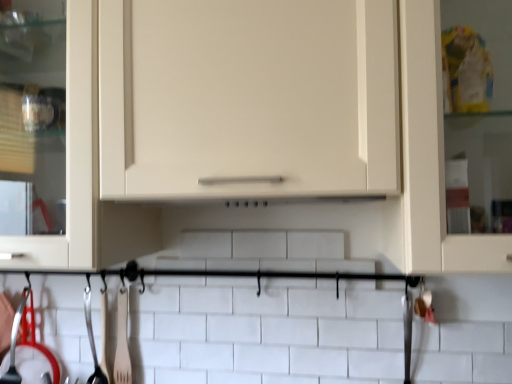
The width and height of the screenshot is (512, 384). What do you see at coordinates (28, 351) in the screenshot? I see `shiny metallic spoon at lower left, which is counted as the 3th silverware, starting from the right` at bounding box center [28, 351].

The width and height of the screenshot is (512, 384). What are the coordinates of `polished metal spatula at lower left, which is counted as the 2th silverware, starting from the right` in the screenshot? It's located at (92, 341).

Considering the positions of objects polished metal spatula at lower left, which is counted as the 2th silverware, starting from the right, and wooden fork at lower left, which appears as the first silverware when viewed from the right, in the image provided, who is in front, polished metal spatula at lower left, which is counted as the 2th silverware, starting from the right, or wooden fork at lower left, which appears as the first silverware when viewed from the right,?

wooden fork at lower left, which appears as the first silverware when viewed from the right, is in front.

What's the angular difference between polished metal spatula at lower left, which is counted as the 2th silverware, starting from the right, and wooden fork at lower left, the 4th silverware when ordered from left to right,'s facing directions?

The facing directions of polished metal spatula at lower left, which is counted as the 2th silverware, starting from the right, and wooden fork at lower left, the 4th silverware when ordered from left to right, are 0.000461 degrees apart.

Could you tell me if polished metal spatula at lower left, which is counted as the 2th silverware, starting from the right, is facing wooden fork at lower left, the 4th silverware when ordered from left to right?

No.

Considering the sizes of objects polished metal spatula at lower left, which is counted as the 2th silverware, starting from the right, and wooden fork at lower left, the 4th silverware when ordered from left to right, in the image provided, who is smaller, polished metal spatula at lower left, which is counted as the 2th silverware, starting from the right, or wooden fork at lower left, the 4th silverware when ordered from left to right,?

With smaller size is wooden fork at lower left, the 4th silverware when ordered from left to right.

Can you tell me how much matte white cabinet at center and polished metal ladle at lower left, the 1th silverware from the left, differ in facing direction?

There is a 22.2-degree angle between the facing directions of matte white cabinet at center and polished metal ladle at lower left, the 1th silverware from the left.

Is matte white cabinet at center positioned with its back to polished metal ladle at lower left, the 1th silverware from the left?

No, matte white cabinet at center is not facing the opposite direction of polished metal ladle at lower left, the 1th silverware from the left.

Where is `the 1st silverware below the matte white cabinet at center (from a real-world perspective)`? This screenshot has height=384, width=512. the 1st silverware below the matte white cabinet at center (from a real-world perspective) is located at coordinates (15, 343).

Can you confirm if polished metal ladle at lower left, positioned as the fourth silverware in right-to-left order, is shorter than wooden fork at lower left, which appears as the first silverware when viewed from the right?

No.

From the image's perspective, is polished metal ladle at lower left, the 1th silverware from the left, on wooden fork at lower left, which appears as the first silverware when viewed from the right?

Actually, polished metal ladle at lower left, the 1th silverware from the left, appears below wooden fork at lower left, which appears as the first silverware when viewed from the right, in the image.

Where is `the 1st silverware directly beneath the polished metal ladle at lower left, the 1th silverware from the left (from a real-world perspective)`? The height and width of the screenshot is (384, 512). the 1st silverware directly beneath the polished metal ladle at lower left, the 1th silverware from the left (from a real-world perspective) is located at coordinates (122, 340).

How different are the orientations of polished metal ladle at lower left, the 1th silverware from the left, and wooden fork at lower left, the 4th silverware when ordered from left to right, in degrees?

They differ by 21.4 degrees in their facing directions.

Would you say polished metal ladle at lower left, positioned as the fourth silverware in right-to-left order, contains shiny metallic spoon at lower left, which is counted as the 2th silverware, starting from the left?

No, shiny metallic spoon at lower left, which is counted as the 2th silverware, starting from the left, is located outside of polished metal ladle at lower left, positioned as the fourth silverware in right-to-left order.

Is polished metal ladle at lower left, positioned as the fourth silverware in right-to-left order, with shiny metallic spoon at lower left, which is counted as the 2th silverware, starting from the left?

Yes, polished metal ladle at lower left, positioned as the fourth silverware in right-to-left order, is in contact with shiny metallic spoon at lower left, which is counted as the 2th silverware, starting from the left.

Where is `the 3rd silverware in front of the polished metal ladle at lower left, positioned as the fourth silverware in right-to-left order, starting your count from the anchor`? Image resolution: width=512 pixels, height=384 pixels. the 3rd silverware in front of the polished metal ladle at lower left, positioned as the fourth silverware in right-to-left order, starting your count from the anchor is located at coordinates (28, 351).

Is matte white cabinet at center inside polished metal ladle at lower left, positioned as the fourth silverware in right-to-left order?

No, matte white cabinet at center is not inside polished metal ladle at lower left, positioned as the fourth silverware in right-to-left order.

From a real-world perspective, is polished metal ladle at lower left, positioned as the fourth silverware in right-to-left order, positioned under matte white cabinet at center based on gravity?

Yes, from a real-world perspective, polished metal ladle at lower left, positioned as the fourth silverware in right-to-left order, is under matte white cabinet at center.

Locate an element on the screen. The width and height of the screenshot is (512, 384). the 4th silverware behind the matte white cabinet at center is located at coordinates (15, 343).

Which object is positioned more to the left, polished metal ladle at lower left, positioned as the fourth silverware in right-to-left order, or matte white cabinet at center?

From the viewer's perspective, polished metal ladle at lower left, positioned as the fourth silverware in right-to-left order, appears more on the left side.

Are matte white cabinet at center and shiny metallic spoon at lower left, which is counted as the 3th silverware, starting from the right, far apart?

No, matte white cabinet at center is not far from shiny metallic spoon at lower left, which is counted as the 3th silverware, starting from the right.

From a real-world perspective, who is located lower, matte white cabinet at center or shiny metallic spoon at lower left, which is counted as the 3th silverware, starting from the right?

In real-world perspective, shiny metallic spoon at lower left, which is counted as the 3th silverware, starting from the right, is lower.

Relative to shiny metallic spoon at lower left, which is counted as the 2th silverware, starting from the left, is matte white cabinet at center in front or behind?

In the image, matte white cabinet at center appears in front of shiny metallic spoon at lower left, which is counted as the 2th silverware, starting from the left.

Can you confirm if matte white cabinet at center is taller than shiny metallic spoon at lower left, which is counted as the 2th silverware, starting from the left?

Indeed, matte white cabinet at center has a greater height compared to shiny metallic spoon at lower left, which is counted as the 2th silverware, starting from the left.

Which of these two, shiny metallic spoon at lower left, which is counted as the 3th silverware, starting from the right, or polished metal ladle at lower left, positioned as the fourth silverware in right-to-left order, stands taller?

polished metal ladle at lower left, positioned as the fourth silverware in right-to-left order.

Considering the relative positions of shiny metallic spoon at lower left, which is counted as the 3th silverware, starting from the right, and polished metal ladle at lower left, positioned as the fourth silverware in right-to-left order, in the image provided, is shiny metallic spoon at lower left, which is counted as the 3th silverware, starting from the right, to the left of polished metal ladle at lower left, positioned as the fourth silverware in right-to-left order, from the viewer's perspective?

No, shiny metallic spoon at lower left, which is counted as the 3th silverware, starting from the right, is not to the left of polished metal ladle at lower left, positioned as the fourth silverware in right-to-left order.

Which object is thinner, shiny metallic spoon at lower left, which is counted as the 3th silverware, starting from the right, or polished metal ladle at lower left, positioned as the fourth silverware in right-to-left order?

With smaller width is polished metal ladle at lower left, positioned as the fourth silverware in right-to-left order.

Is shiny metallic spoon at lower left, which is counted as the 2th silverware, starting from the left, further to the viewer compared to polished metal ladle at lower left, the 1th silverware from the left?

→ No.

From a real-world perspective, which silverware is the 2nd one underneath the wooden fork at lower left, the 4th silverware when ordered from left to right? Please provide its 2D coordinates.

[(92, 341)]

The width and height of the screenshot is (512, 384). In order to click on cabinetry lying above the polished metal ladle at lower left, positioned as the fourth silverware in right-to-left order (from the image's perspective) in this screenshot , I will do `click(255, 127)`.

Looking at the image, which one is located further to polished metal ladle at lower left, positioned as the fourth silverware in right-to-left order, polished metal spatula at lower left, which is counted as the 2th silverware, starting from the right, or matte white cabinet at center?

Among the two, matte white cabinet at center is located further to polished metal ladle at lower left, positioned as the fourth silverware in right-to-left order.

Looking at the image, which one is located further to matte white cabinet at center, wooden fork at lower left, which appears as the first silverware when viewed from the right, or shiny metallic spoon at lower left, which is counted as the 3th silverware, starting from the right?

shiny metallic spoon at lower left, which is counted as the 3th silverware, starting from the right.

Considering their positions, is matte white cabinet at center positioned further to polished metal spatula at lower left, which is counted as the 2th silverware, starting from the right, than polished metal ladle at lower left, positioned as the fourth silverware in right-to-left order?

Among the two, matte white cabinet at center is located further to polished metal spatula at lower left, which is counted as the 2th silverware, starting from the right.

Considering their positions, is shiny metallic spoon at lower left, which is counted as the 3th silverware, starting from the right, positioned closer to polished metal ladle at lower left, positioned as the fourth silverware in right-to-left order, than polished metal spatula at lower left, positioned as the 3th silverware in left-to-right order?

Based on the image, shiny metallic spoon at lower left, which is counted as the 3th silverware, starting from the right, appears to be nearer to polished metal ladle at lower left, positioned as the fourth silverware in right-to-left order.

Looking at the image, which one is located closer to shiny metallic spoon at lower left, which is counted as the 3th silverware, starting from the right, polished metal ladle at lower left, the 1th silverware from the left, or wooden fork at lower left, the 4th silverware when ordered from left to right?

polished metal ladle at lower left, the 1th silverware from the left, is positioned closer to the anchor shiny metallic spoon at lower left, which is counted as the 3th silverware, starting from the right.

In the scene shown: Based on their spatial positions, is matte white cabinet at center or wooden fork at lower left, which appears as the first silverware when viewed from the right, closer to shiny metallic spoon at lower left, which is counted as the 2th silverware, starting from the left?

wooden fork at lower left, which appears as the first silverware when viewed from the right.

Based on their spatial positions, is matte white cabinet at center or polished metal spatula at lower left, which is counted as the 2th silverware, starting from the right, further from polished metal ladle at lower left, the 1th silverware from the left?

The object further to polished metal ladle at lower left, the 1th silverware from the left, is matte white cabinet at center.

When comparing their distances from polished metal spatula at lower left, which is counted as the 2th silverware, starting from the right, does polished metal ladle at lower left, positioned as the fourth silverware in right-to-left order, or matte white cabinet at center seem further?

Among the two, matte white cabinet at center is located further to polished metal spatula at lower left, which is counted as the 2th silverware, starting from the right.

The height and width of the screenshot is (384, 512). Identify the location of silverware between polished metal ladle at lower left, positioned as the fourth silverware in right-to-left order, and polished metal spatula at lower left, positioned as the 3th silverware in left-to-right order, in the horizontal direction. (28, 351).

Locate an element on the screen. This screenshot has height=384, width=512. silverware between shiny metallic spoon at lower left, which is counted as the 2th silverware, starting from the left, and wooden fork at lower left, the 4th silverware when ordered from left to right, in the horizontal direction is located at coordinates (92, 341).

The image size is (512, 384). Identify the location of silverware between matte white cabinet at center and polished metal ladle at lower left, positioned as the fourth silverware in right-to-left order, from top to bottom. (122, 340).